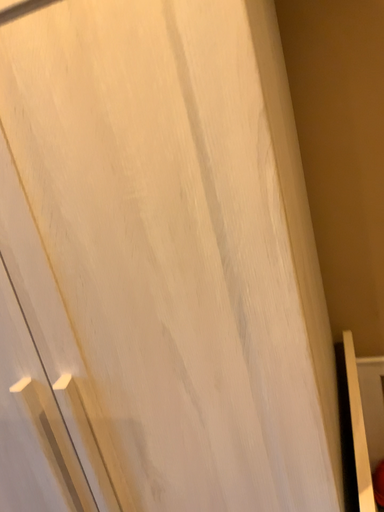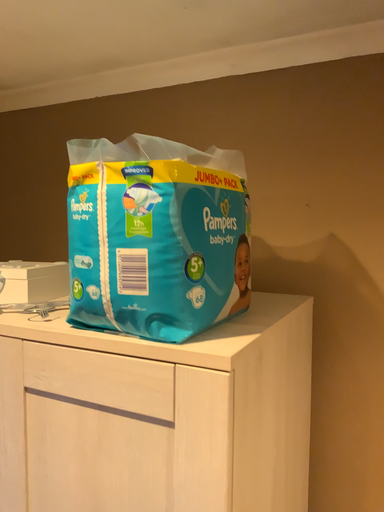
Question: Which way did the camera rotate in the video?

Choices:
 (A) rotated upward
 (B) rotated downward

Answer: (A)